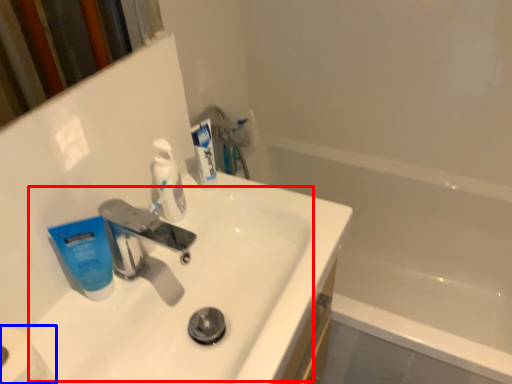
Question: Which of the following is the closest to the observer, sink (highlighted by a red box) or toilet paper (highlighted by a blue box)?

Choices:
 (A) sink
 (B) toilet paper

Answer: (B)